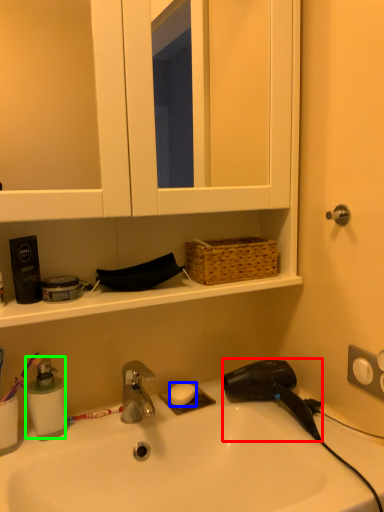
Question: Considering the real-world distances, which object is farthest from hair drier (highlighted by a red box)? soap (highlighted by a blue box) or soap dispenser (highlighted by a green box)?

Choices:
 (A) soap
 (B) soap dispenser

Answer: (B)